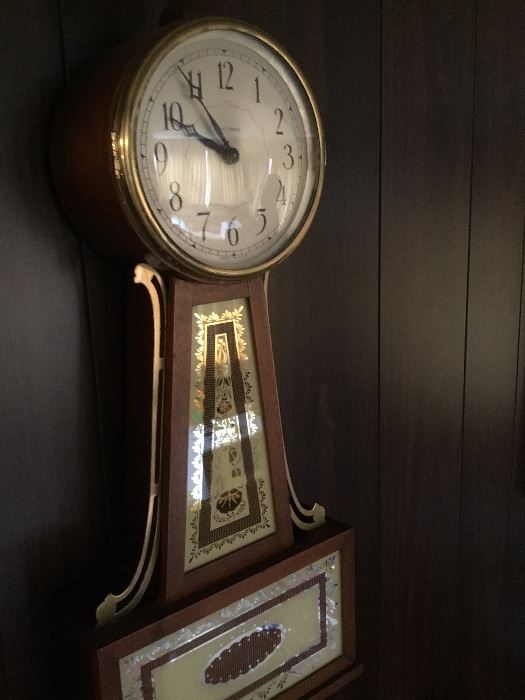
In order to click on clock face in this screenshot , I will do `click(236, 152)`.